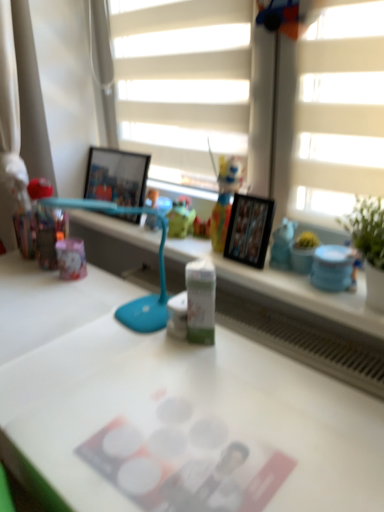
Question: Is translucent plastic toy at center to the left of wooden photo frame at upper center, acting as the first picture frame starting from the top, from the viewer's perspective?

Choices:
 (A) yes
 (B) no

Answer: (B)

Question: Considering the relative positions of translucent plastic toy at center and wooden photo frame at upper center, the first picture frame from the back, in the image provided, is translucent plastic toy at center behind wooden photo frame at upper center, the first picture frame from the back,?

Choices:
 (A) yes
 (B) no

Answer: (B)

Question: Is translucent plastic toy at center positioned in front of wooden photo frame at upper center, which appears as the 2th picture frame when viewed from the right?

Choices:
 (A) yes
 (B) no

Answer: (A)

Question: Is translucent plastic toy at center thinner than wooden photo frame at upper center, the first picture frame from the back?

Choices:
 (A) yes
 (B) no

Answer: (A)

Question: Does translucent plastic toy at center have a larger size compared to wooden photo frame at upper center, acting as the first picture frame starting from the top?

Choices:
 (A) no
 (B) yes

Answer: (A)

Question: Considering the relative sizes of translucent plastic toy at center and wooden photo frame at upper center, the first picture frame from the back, in the image provided, is translucent plastic toy at center smaller than wooden photo frame at upper center, the first picture frame from the back,?

Choices:
 (A) yes
 (B) no

Answer: (A)

Question: Does green matte milk carton at center, placed as the 2th stationery when sorted from right to left, appear on the left side of white matte desk at center?

Choices:
 (A) yes
 (B) no

Answer: (B)

Question: Can we say green matte milk carton at center, the 1th stationery when ordered from left to right, lies outside white matte desk at center?

Choices:
 (A) no
 (B) yes

Answer: (B)

Question: Can you confirm if green matte milk carton at center, placed as the 2th stationery when sorted from right to left, is thinner than white matte desk at center?

Choices:
 (A) no
 (B) yes

Answer: (B)

Question: From a real-world perspective, is green matte milk carton at center, the 1th stationery when ordered from left to right, beneath white matte desk at center?

Choices:
 (A) no
 (B) yes

Answer: (A)

Question: From a real-world perspective, is green matte milk carton at center, the 1th stationery when ordered from left to right, located higher than white matte desk at center?

Choices:
 (A) no
 (B) yes

Answer: (B)

Question: Is green matte milk carton at center, placed as the 2th stationery when sorted from right to left, at the right side of white matte desk at center?

Choices:
 (A) no
 (B) yes

Answer: (B)

Question: Does white matte desk at center have a larger size compared to teal plastic table lamp at center?

Choices:
 (A) no
 (B) yes

Answer: (B)